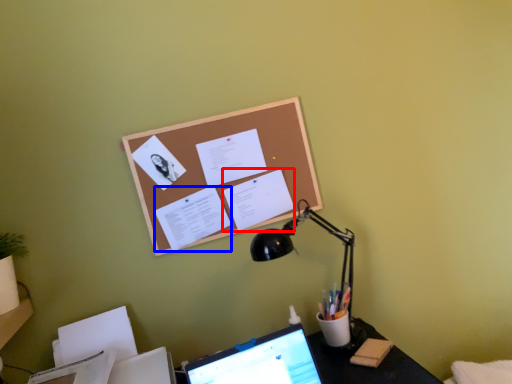
Question: Which point is closer to the camera, document (highlighted by a red box) or document (highlighted by a blue box)?

Choices:
 (A) document
 (B) document

Answer: (B)